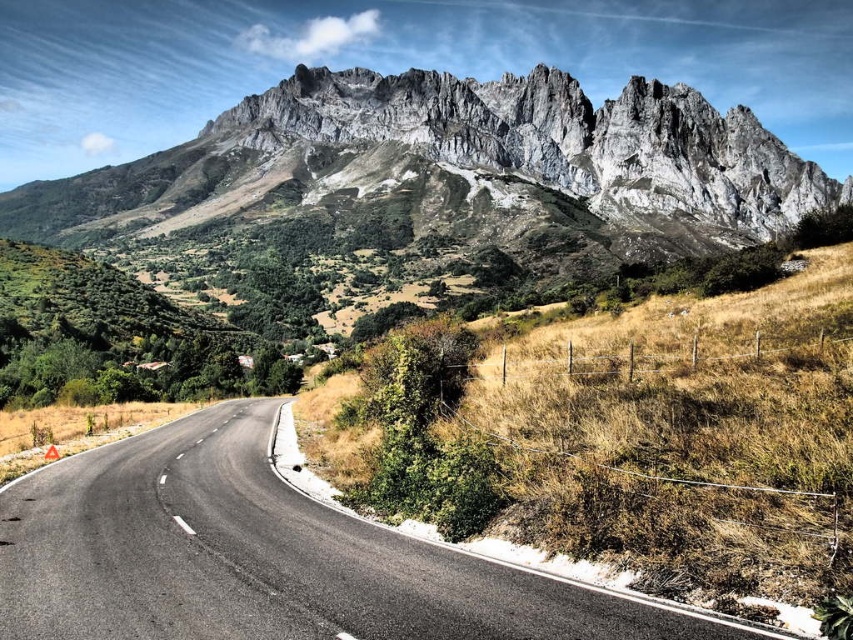
Question: Can you confirm if rugged stone mountain range at upper center is positioned below black asphalt road at center?

Choices:
 (A) no
 (B) yes

Answer: (A)

Question: Which object appears farthest from the camera in this image?

Choices:
 (A) rugged stone mountain range at upper center
 (B) black asphalt road at center

Answer: (A)

Question: Which of the following is the closest to the observer?

Choices:
 (A) rugged stone mountain range at upper center
 (B) black asphalt road at center

Answer: (B)

Question: Can you confirm if rugged stone mountain range at upper center is smaller than black asphalt road at center?

Choices:
 (A) no
 (B) yes

Answer: (A)

Question: Is rugged stone mountain range at upper center above black asphalt road at center?

Choices:
 (A) yes
 (B) no

Answer: (A)